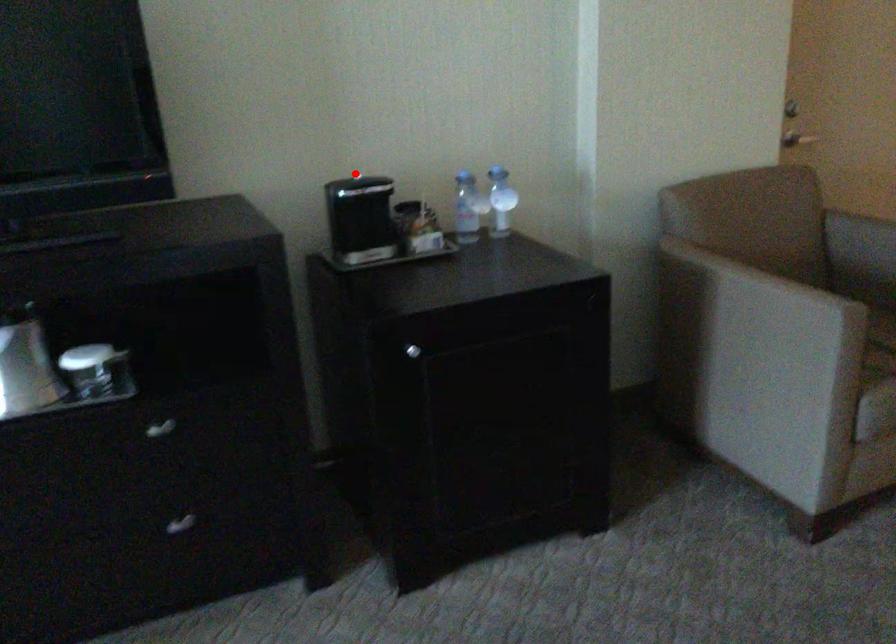
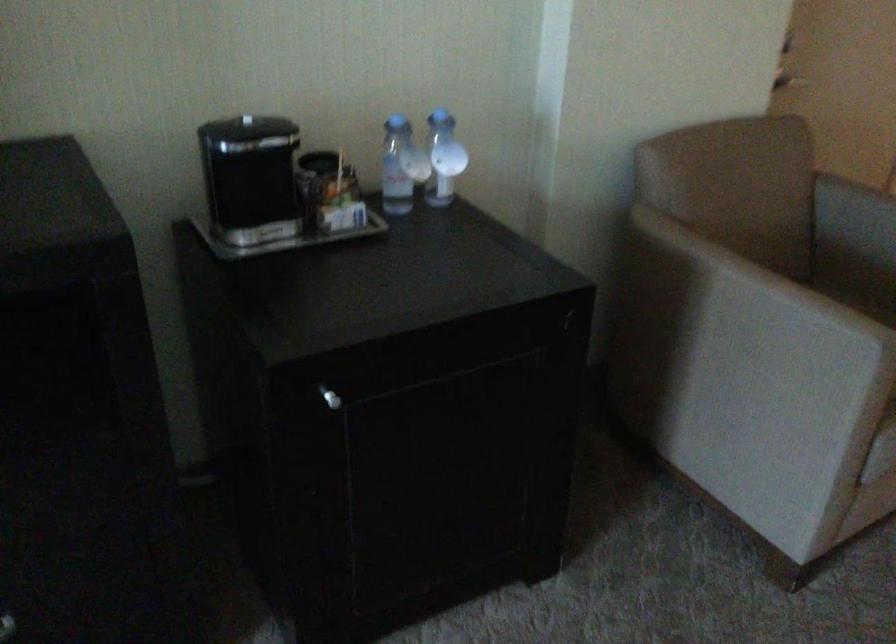
In the second image, find the point that corresponds to the highlighted location in the first image.

(246, 120)